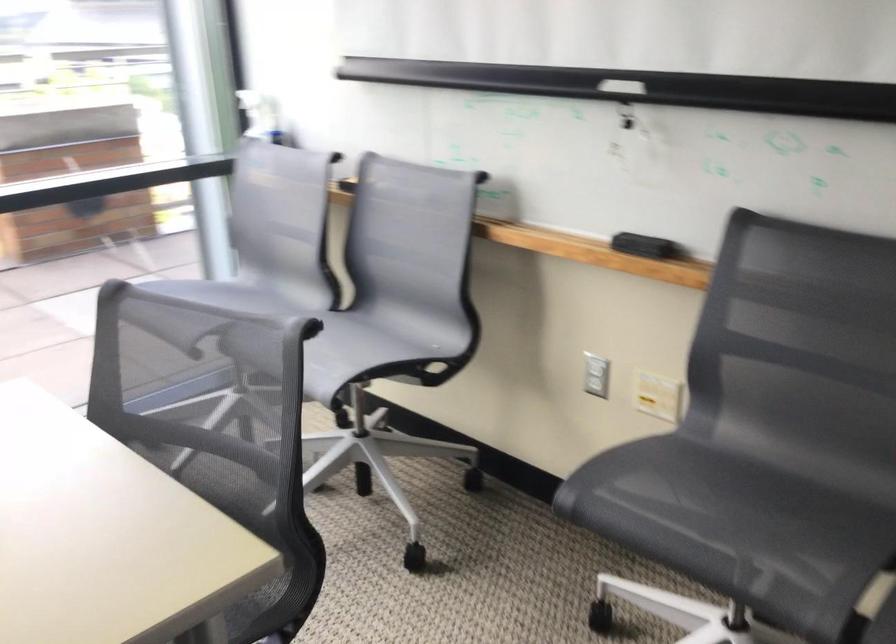
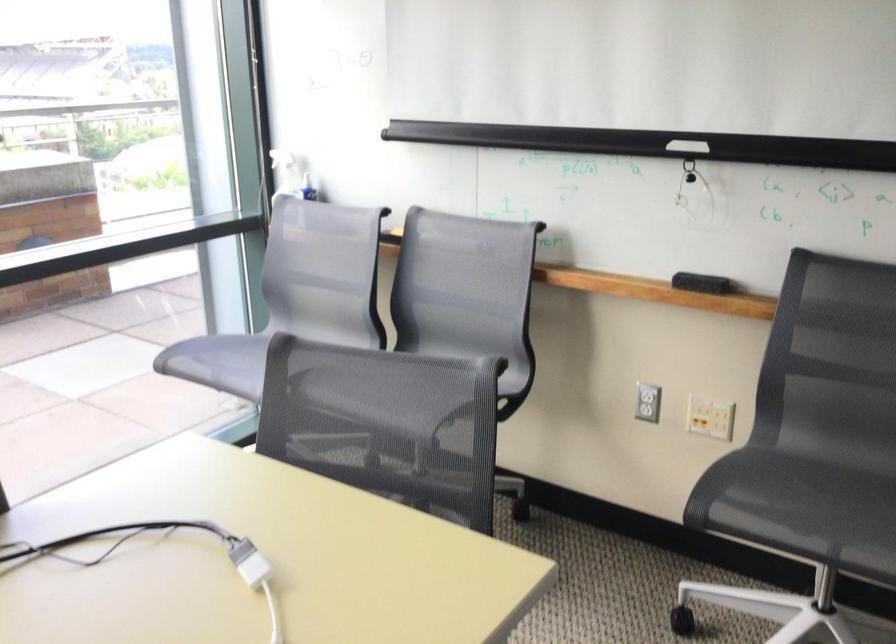
Question: I am providing you with two images of the same scene from different viewpoints. Please identify which objects are invisible in image2.

Choices:
 (A) white candle holder
 (B) white spray bottle
 (C) black whiteboard eraser
 (D) gray chair sitting surface

Answer: (D)